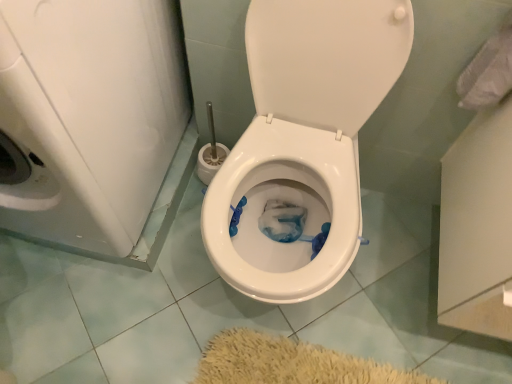
Question: Would you say white glossy washer at left is inside or outside white glossy toilet at center?

Choices:
 (A) outside
 (B) inside

Answer: (A)

Question: Considering the relative positions of white glossy washer at left and white glossy toilet at center in the image provided, is white glossy washer at left to the left or to the right of white glossy toilet at center?

Choices:
 (A) left
 (B) right

Answer: (A)

Question: Based on their relative distances, which object is farther from the white glossy washer at left?

Choices:
 (A) white fabric at upper right
 (B) white glossy toilet at center

Answer: (A)

Question: Which object is positioned farthest from the white glossy toilet at center?

Choices:
 (A) white glossy washer at left
 (B) white fabric at upper right

Answer: (B)